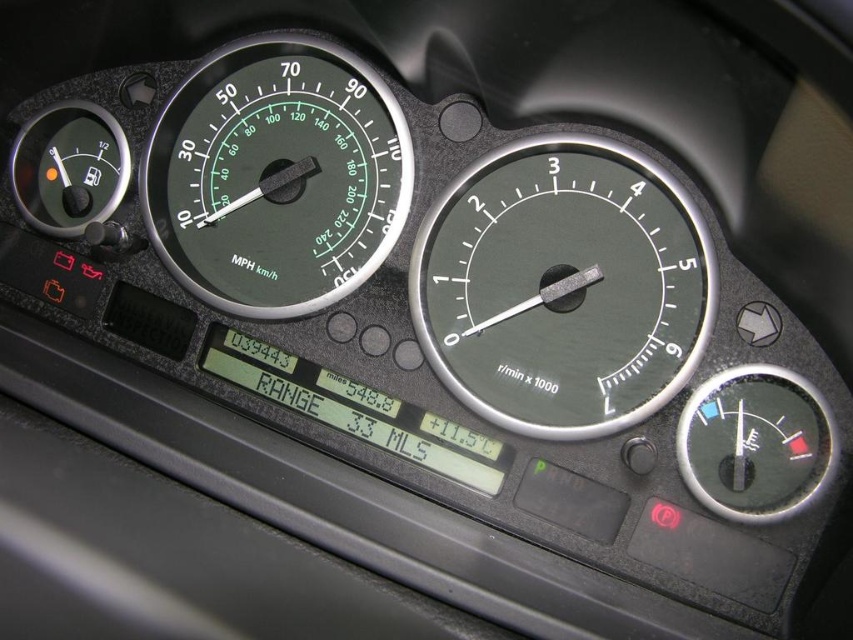
You are driving a car and notice two dials on the dashboard. The first is a green matte speedometer at center, and the second is a matte black tachometer at center. Which dial is positioned to the right of the other?

The matte black tachometer at center is to the right of the green matte speedometer at center.

You are a mechanic inspecting the car dashboard. You notice two dials labeled matte black tachometer at center and green matte speedometer at center. Which of these dials is smaller in size?

The matte black tachometer at center has a smaller size compared to the green matte speedometer at center, so the matte black tachometer at center is smaller.